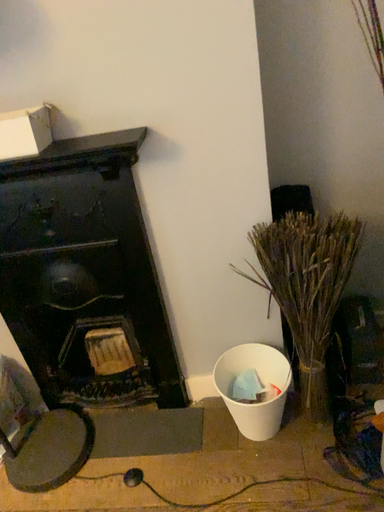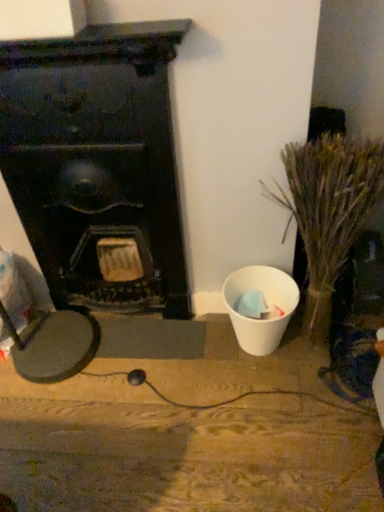
Question: Which way did the camera rotate in the video?

Choices:
 (A) rotated downward
 (B) rotated upward

Answer: (A)